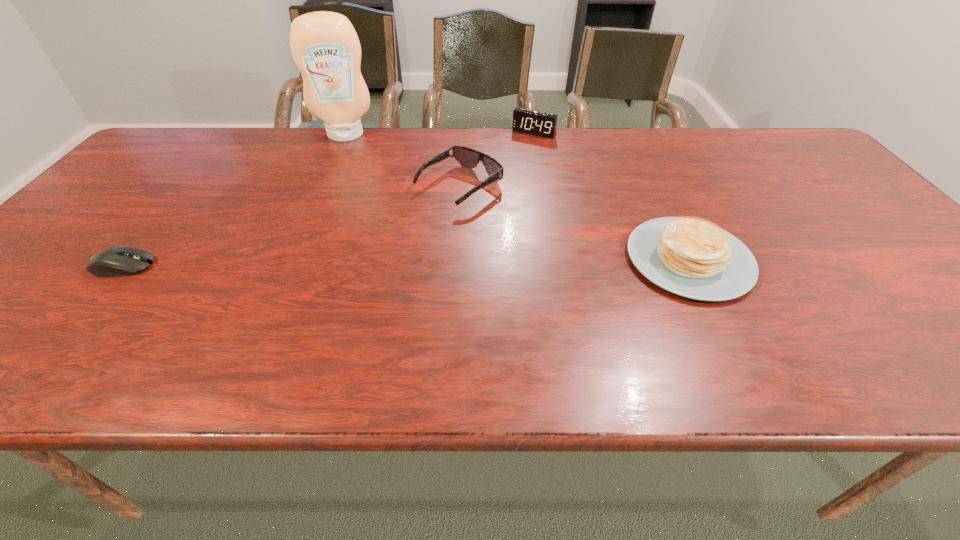
Find the location of a particular element. vacant space located on the front-facing side of the third farthest object is located at coordinates (328, 273).

Image resolution: width=960 pixels, height=540 pixels. Identify the location of free location located 0.330m on the front-facing side of the third farthest object. (321, 278).

Identify the location of vacant space located 0.260m on the front-facing side of the third farthest object. click(x=347, y=261).

The width and height of the screenshot is (960, 540). Identify the location of vacant space located 0.110m on the label of the tallest object. (348, 162).

This screenshot has width=960, height=540. What are the coordinates of `vacant region located on the label of the tallest object` in the screenshot? It's located at (347, 184).

Find the location of a particular element. This screenshot has width=960, height=540. blank area located 0.170m on the label of the tallest object is located at coordinates (347, 173).

This screenshot has height=540, width=960. What are the coordinates of `vacant area situated on the front-facing side of the second object from right to left` in the screenshot? It's located at (496, 182).

I want to click on vacant space located on the front-facing side of the second object from right to left, so click(506, 168).

At what (x,y) coordinates should I click in order to perform the action: click on vacant space positioned 0.070m on the front-facing side of the second object from right to left. Please return your answer as a coordinate pair (x, y). Looking at the image, I should click on (519, 148).

Locate an element on the screen. This screenshot has height=540, width=960. sunglasses located in the far edge section of the desktop is located at coordinates (467, 157).